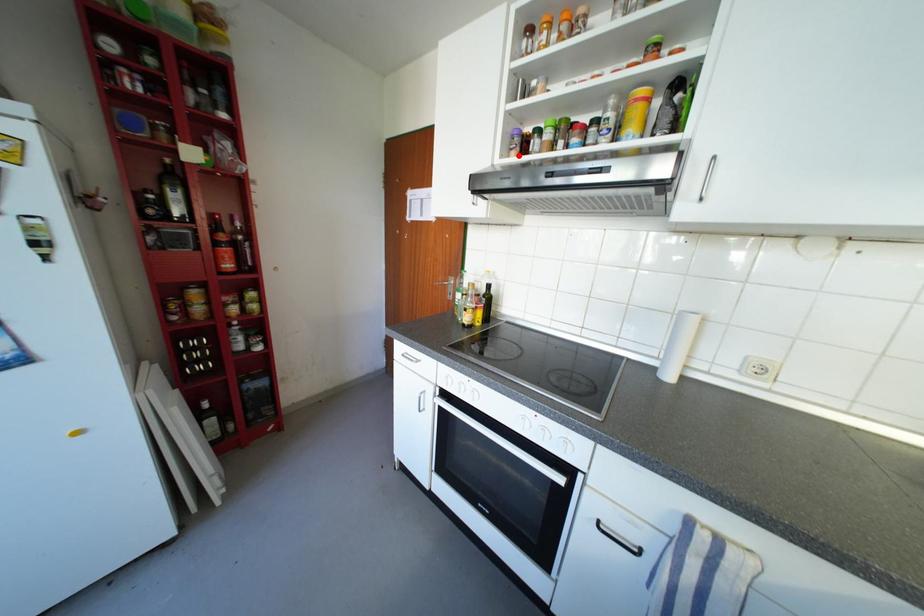
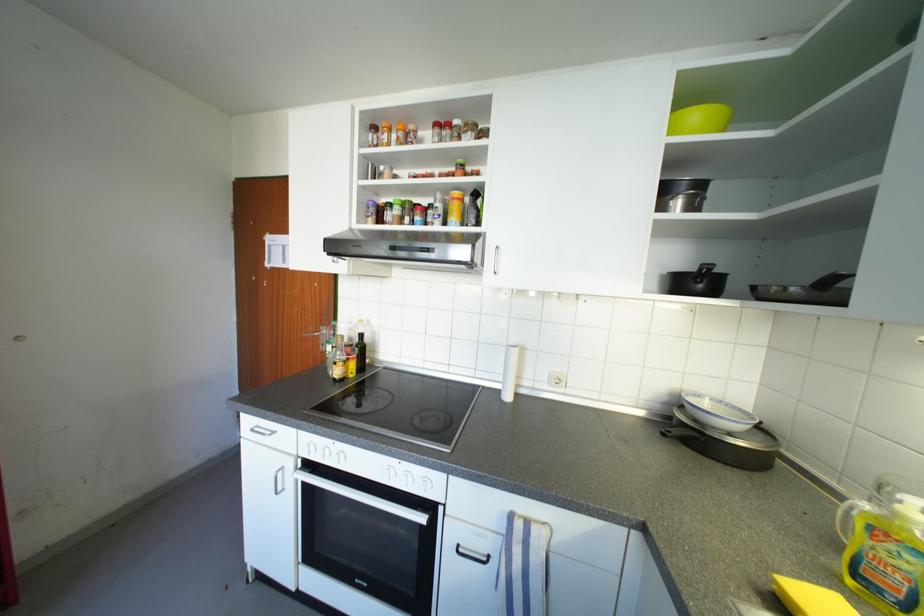
Find the pixel in the second image that matches the highlighted location in the first image.

(375, 223)